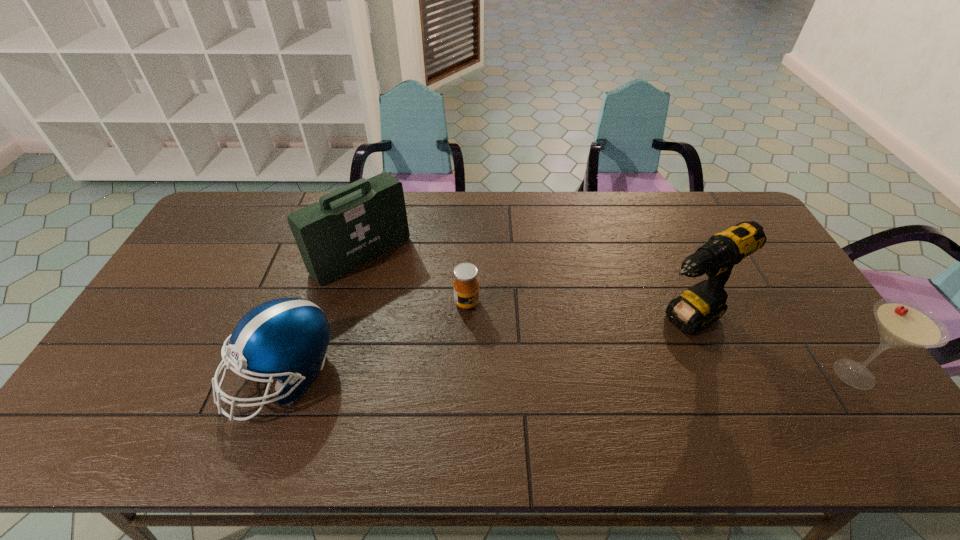
The image size is (960, 540). I want to click on vacant space located 0.350m on the front-facing side of the first-aid kit, so click(462, 347).

I want to click on vacant area situated at the tip of the second object from right to left, so click(636, 344).

Identify the location of vacant space located 0.370m at the tip of the second object from right to left. (551, 400).

The width and height of the screenshot is (960, 540). What are the coordinates of `vacant region located 0.160m at the tip of the second object from right to left` in the screenshot? It's located at (612, 360).

Locate an element on the screen. This screenshot has height=540, width=960. vacant position located on the front-facing side of the honey is located at coordinates click(x=534, y=339).

Locate an element on the screen. This screenshot has height=540, width=960. vacant space located 0.060m on the front-facing side of the honey is located at coordinates (494, 318).

Where is `free space located 0.210m on the front-facing side of the honey`? This screenshot has height=540, width=960. free space located 0.210m on the front-facing side of the honey is located at coordinates (540, 342).

Locate an element on the screen. object that is at the far edge is located at coordinates (350, 226).

Where is `football helmet present at the near edge`? The image size is (960, 540). football helmet present at the near edge is located at coordinates (286, 338).

This screenshot has height=540, width=960. In order to click on martini situated at the near edge in this screenshot , I will do `click(902, 324)`.